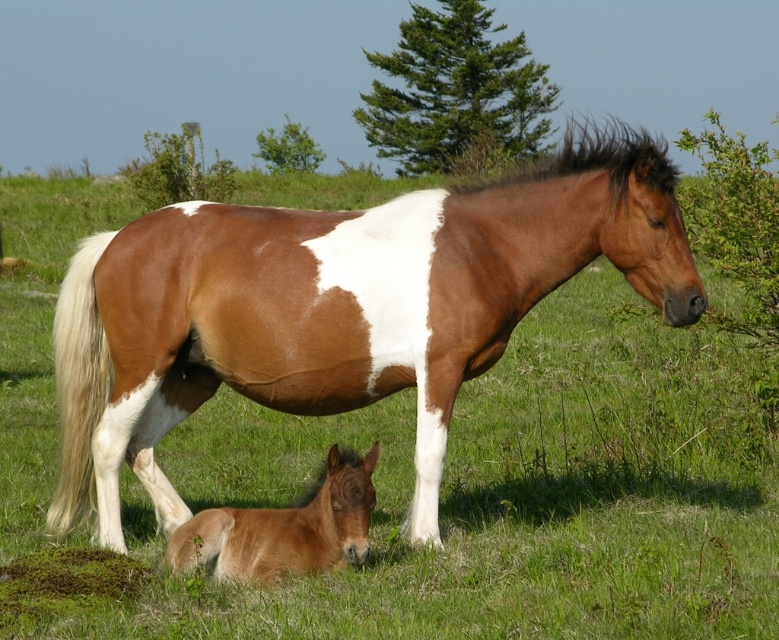
Question: Which point is farther to the camera?

Choices:
 (A) brown matte foal at lower left
 (B) brown glossy horse at center

Answer: (B)

Question: Which object appears farthest from the camera in this image?

Choices:
 (A) brown glossy horse at center
 (B) brown matte foal at lower left

Answer: (A)

Question: Can you confirm if brown glossy horse at center is thinner than brown matte foal at lower left?

Choices:
 (A) no
 (B) yes

Answer: (B)

Question: Is brown glossy horse at center to the right of brown matte foal at lower left from the viewer's perspective?

Choices:
 (A) yes
 (B) no

Answer: (A)

Question: Is brown glossy horse at center positioned at the back of brown matte foal at lower left?

Choices:
 (A) no
 (B) yes

Answer: (B)